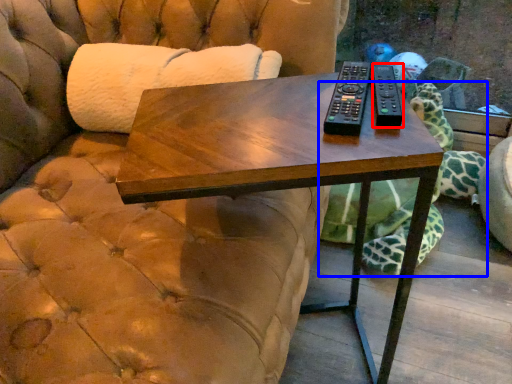
Question: Which of the following is the farthest to the observer, remote (highlighted by a red box) or tortoise (highlighted by a blue box)?

Choices:
 (A) remote
 (B) tortoise

Answer: (B)